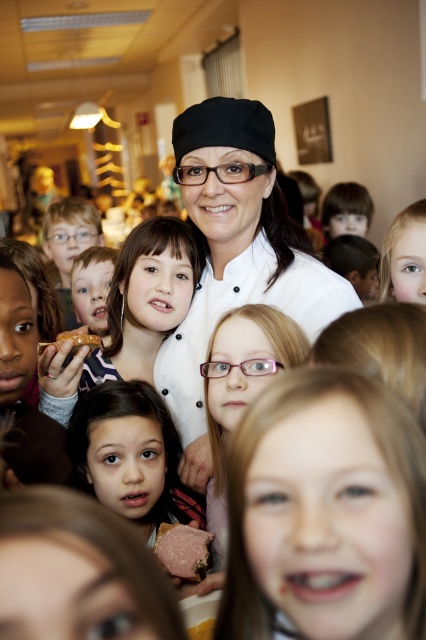
Can you confirm if matte brown hair at center is positioned to the left of brown bread at center?

Incorrect, matte brown hair at center is not on the left side of brown bread at center.

Identify the location of matte brown hair at center. (127, 452).

Locate an element on the screen. matte brown hair at center is located at coordinates (127, 452).

Is matte white shirt at center smaller than pink matte sandwich at center?

No, matte white shirt at center is not smaller than pink matte sandwich at center.

Locate an element on the screen. This screenshot has width=426, height=640. matte white shirt at center is located at coordinates (92, 285).

Who is more forward, (x=103, y=248) or (x=210, y=538)?

Point (x=210, y=538) is in front.

Find the location of `matte white shirt at center`. matte white shirt at center is located at coordinates (92, 285).

Which is in front, point (114, 422) or point (108, 276)?

Point (114, 422) is in front.

Can you confirm if matte brown hair at center is positioned below matte white shirt at center?

Yes.

Where is `matte brown hair at center`? Image resolution: width=426 pixels, height=640 pixels. matte brown hair at center is located at coordinates (127, 452).

At what (x,y) coordinates should I click in order to perform the action: click on matte brown hair at center. Please return your answer as a coordinate pair (x, y). This screenshot has height=640, width=426. Looking at the image, I should click on point(127,452).